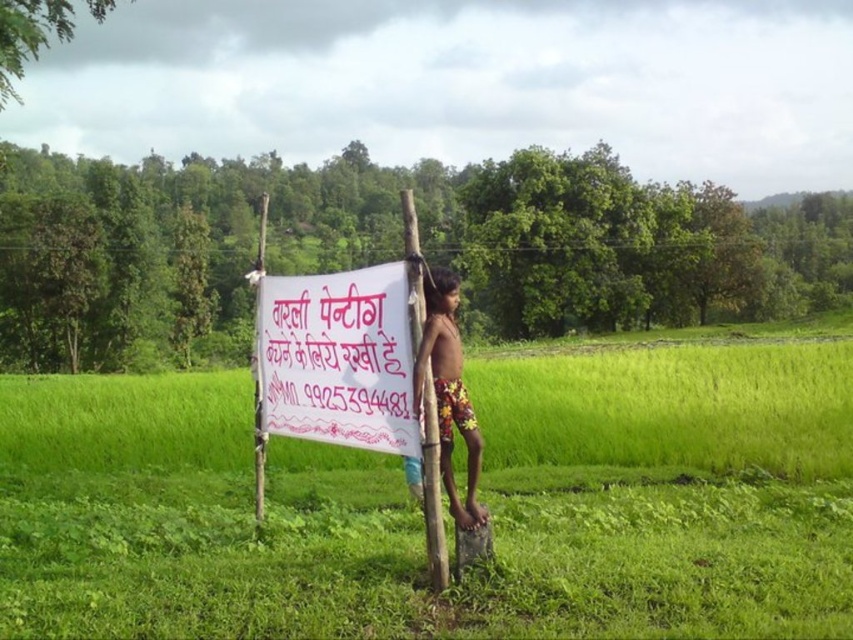
Which is behind, point (293, 276) or point (427, 516)?

Point (293, 276)

I want to click on white paper banner at center, so click(x=338, y=358).

Can you confirm if floral shorts at center is bigger than smooth bamboo pole at center?

No.

Which of these two, floral shorts at center or smooth bamboo pole at center, stands taller?

smooth bamboo pole at center is taller.

Is point (445, 428) positioned behind point (413, 212)?

Yes, point (445, 428) is farther from viewer.

Find the location of a particular element. The width and height of the screenshot is (853, 640). floral shorts at center is located at coordinates (448, 390).

Who is taller, green grass at center or white paper banner at center?

Standing taller between the two is green grass at center.

Is point (709, 497) closer to viewer compared to point (409, 449)?

No, (709, 497) is behind (409, 449).

Image resolution: width=853 pixels, height=640 pixels. Identify the location of green grass at center. (668, 490).